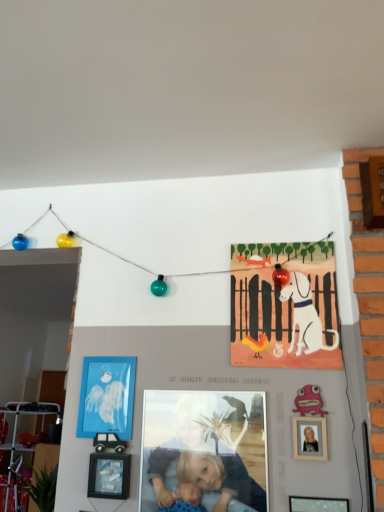
Question: Visually, is smooth skin child at center positioned to the left or to the right of wooden picture frame at lower center, which appears as the second picture frame when viewed from the front?

Choices:
 (A) right
 (B) left

Answer: (A)

Question: From the image's perspective, is smooth skin child at center above or below wooden picture frame at lower center, positioned as the 2th picture frame in top-to-bottom order?

Choices:
 (A) above
 (B) below

Answer: (A)

Question: Which object is positioned closest to the smooth skin child at center?

Choices:
 (A) matte black picture frame at lower right, which is the third picture frame in back-to-front order
 (B) blue paper picture frame at lower left, which is the 1th picture frame from top to bottom
 (C) wooden picture frame at lower center, marked as the 2th picture frame in a left-to-right arrangement
 (D) matte paper poster at upper center

Answer: (B)

Question: Based on their relative distances, which object is farther from the smooth skin child at center?

Choices:
 (A) matte black picture frame at lower right, which ranks as the 3th picture frame in left-to-right order
 (B) wooden picture frame at lower center, the second picture frame in the bottom-to-top sequence
 (C) blue paper picture frame at lower left, which appears as the third picture frame when viewed from the front
 (D) matte paper poster at upper center

Answer: (D)